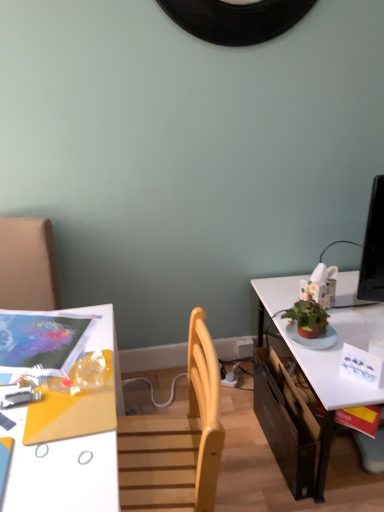
Question: From their relative heights in the image, would you say matte plastic magazine at upper left is taller or shorter than white glossy desk at lower left?

Choices:
 (A) short
 (B) tall

Answer: (A)

Question: Is matte plastic magazine at upper left bigger or smaller than white glossy desk at lower left?

Choices:
 (A) small
 (B) big

Answer: (A)

Question: Estimate the real-world distances between objects in this image. Which object is closer to the white glossy desk at lower left?

Choices:
 (A) black cardboard drawer at lower right
 (B) matte plastic magazine at upper left
 (C) white glossy table at right

Answer: (B)

Question: Based on their relative distances, which object is nearer to the black cardboard drawer at lower right?

Choices:
 (A) white glossy desk at lower left
 (B) white glossy table at right
 (C) matte plastic magazine at upper left

Answer: (B)